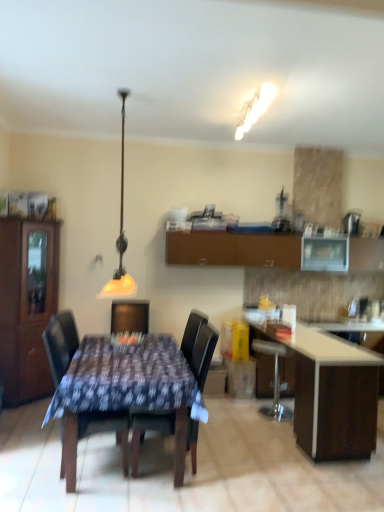
Question: Are matte yellow glass lampshade at upper center and white glossy table at lower right far apart?

Choices:
 (A) yes
 (B) no

Answer: (A)

Question: Does matte yellow glass lampshade at upper center have a greater height compared to white glossy table at lower right?

Choices:
 (A) yes
 (B) no

Answer: (A)

Question: From the image's perspective, does matte yellow glass lampshade at upper center appear lower than white glossy table at lower right?

Choices:
 (A) no
 (B) yes

Answer: (A)

Question: Can you confirm if matte yellow glass lampshade at upper center is bigger than white glossy table at lower right?

Choices:
 (A) yes
 (B) no

Answer: (B)

Question: From the image's perspective, is matte yellow glass lampshade at upper center on top of white glossy table at lower right?

Choices:
 (A) yes
 (B) no

Answer: (A)

Question: Is matte yellow glass lampshade at upper center in contact with white glossy table at lower right?

Choices:
 (A) no
 (B) yes

Answer: (A)

Question: Is wooden table at center completely or partially inside brown matte cabinet at upper center, acting as the 1th cabinetry starting from the back?

Choices:
 (A) yes
 (B) no

Answer: (B)

Question: Is brown matte cabinet at upper center, which is counted as the 2th cabinetry, starting from the left, far from wooden table at center?

Choices:
 (A) yes
 (B) no

Answer: (A)

Question: Considering the relative sizes of brown matte cabinet at upper center, the second cabinetry viewed from the front, and wooden table at center in the image provided, is brown matte cabinet at upper center, the second cabinetry viewed from the front, bigger than wooden table at center?

Choices:
 (A) yes
 (B) no

Answer: (B)

Question: Does brown matte cabinet at upper center, which is counted as the 2th cabinetry, starting from the left, appear on the left side of wooden table at center?

Choices:
 (A) yes
 (B) no

Answer: (B)

Question: Is brown matte cabinet at upper center, the first cabinetry viewed from the right, further to the viewer compared to wooden table at center?

Choices:
 (A) no
 (B) yes

Answer: (B)

Question: From the image's perspective, is brown matte cabinet at upper center, the second cabinetry viewed from the front, on top of wooden table at center?

Choices:
 (A) yes
 (B) no

Answer: (A)

Question: Is brown wood cabinet at left, the second cabinetry viewed from the back, completely or partially outside of brown matte cabinet at upper center, the second cabinetry viewed from the front?

Choices:
 (A) yes
 (B) no

Answer: (A)